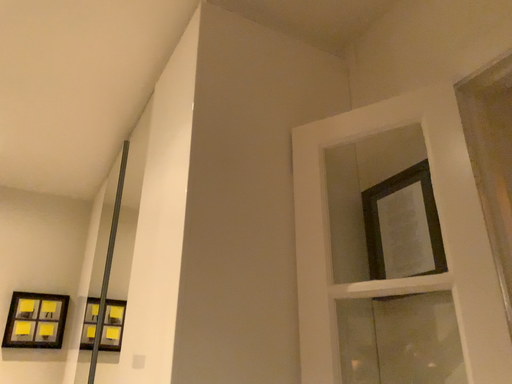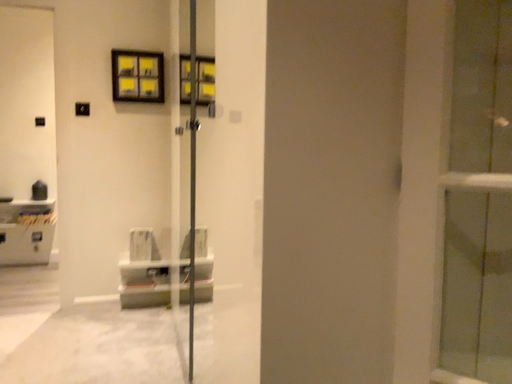
Question: Which way did the camera rotate in the video?

Choices:
 (A) rotated downward
 (B) rotated upward

Answer: (A)